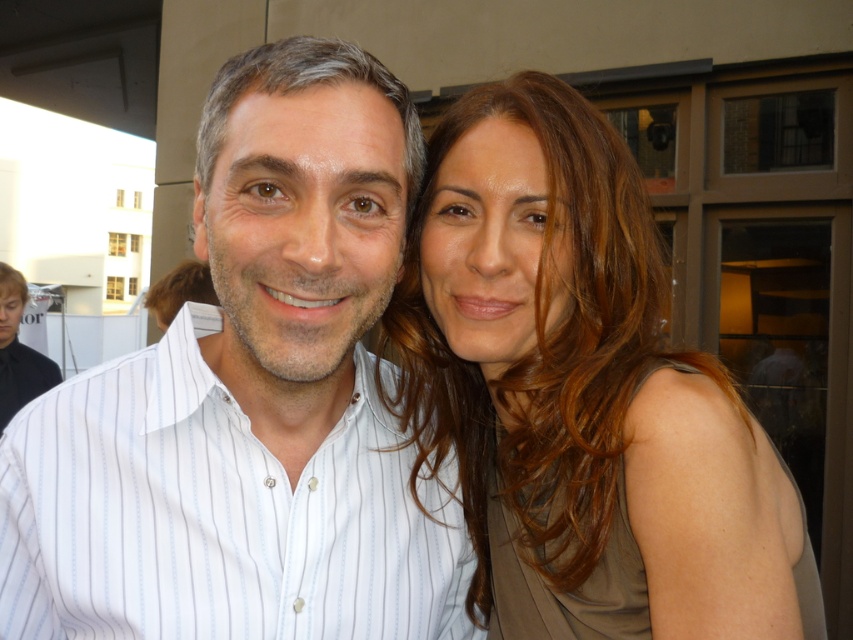
Question: Is white striped shirt at center positioned in front of matte brown hair at upper right?

Choices:
 (A) no
 (B) yes

Answer: (B)

Question: Does white striped shirt at center have a smaller size compared to matte brown hair at upper right?

Choices:
 (A) yes
 (B) no

Answer: (A)

Question: Which point is closer to the camera taking this photo?

Choices:
 (A) (434, 204)
 (B) (287, 129)

Answer: (B)

Question: Is white striped shirt at center bigger than matte brown hair at upper right?

Choices:
 (A) no
 (B) yes

Answer: (A)